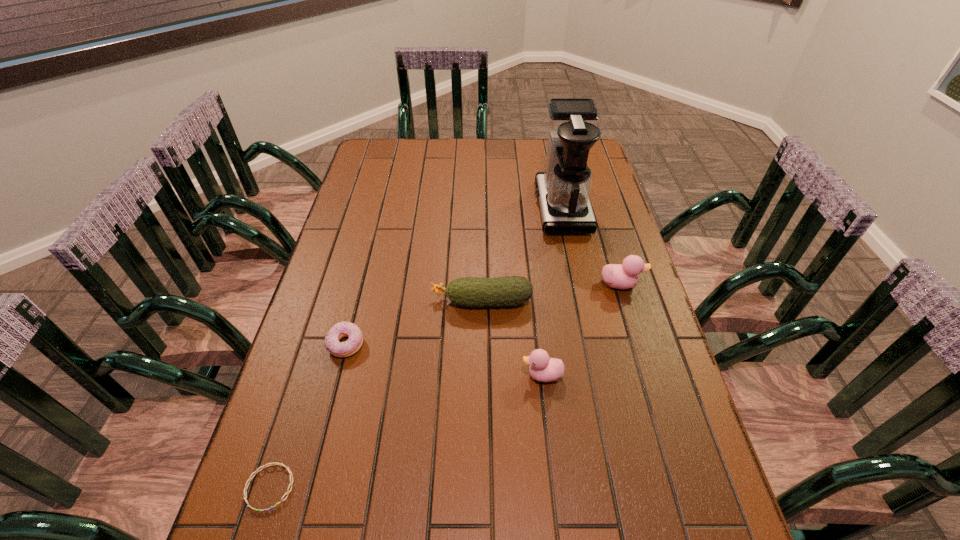
Where is `vacant space at the right edge`? vacant space at the right edge is located at coordinates 647,312.

The image size is (960, 540). In the image, there is a desktop. Find the location of `vacant space at the far left corner`. vacant space at the far left corner is located at coordinates (397, 138).

The image size is (960, 540). In order to click on empty space that is in between the nearest object and the second shortest object in this screenshot , I will do `click(308, 416)`.

Find the location of a particular element. vacant space that is in between the fourth farthest object and the shorter duckling is located at coordinates (444, 360).

Identify the location of free area in between the taller duckling and the farthest object. (591, 246).

At what (x,y) coordinates should I click in order to perform the action: click on vacant area that lies between the tallest object and the shortest object. Please return your answer as a coordinate pair (x, y). Image resolution: width=960 pixels, height=540 pixels. Looking at the image, I should click on (416, 347).

Locate an element on the screen. vacant area that lies between the cucumber and the left duckling is located at coordinates (512, 338).

This screenshot has height=540, width=960. What are the coordinates of `free spot between the third nearest object and the farthest object` in the screenshot? It's located at [454, 276].

Find the location of a particular element. This screenshot has width=960, height=540. free space between the farthest object and the farther duckling is located at coordinates (591, 246).

The image size is (960, 540). In order to click on vacant space that's between the cucumber and the coffee maker in this screenshot , I will do `click(522, 254)`.